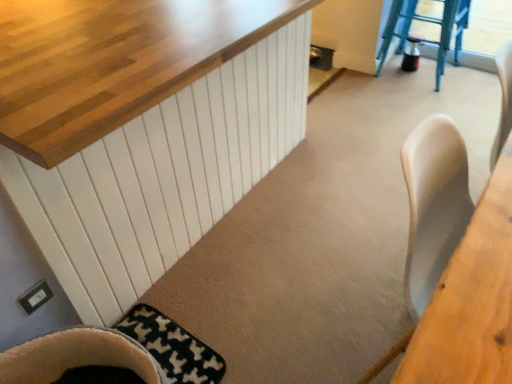
Question: Considering the positions of black and white textured mat at lower left and wooden table at right in the image, is black and white textured mat at lower left taller or shorter than wooden table at right?

Choices:
 (A) tall
 (B) short

Answer: (B)

Question: From the image's perspective, relative to wooden table at right, is black and white textured mat at lower left above or below?

Choices:
 (A) below
 (B) above

Answer: (A)

Question: Which object is the closest to the black and white textured mat at lower left?

Choices:
 (A) wooden table at right
 (B) blue plastic stool at upper right
 (C) soft beige fabric chair at lower left

Answer: (C)

Question: Which object is the farthest from the blue plastic stool at upper right?

Choices:
 (A) black and white textured mat at lower left
 (B) soft beige fabric chair at lower left
 (C) wooden table at right

Answer: (B)